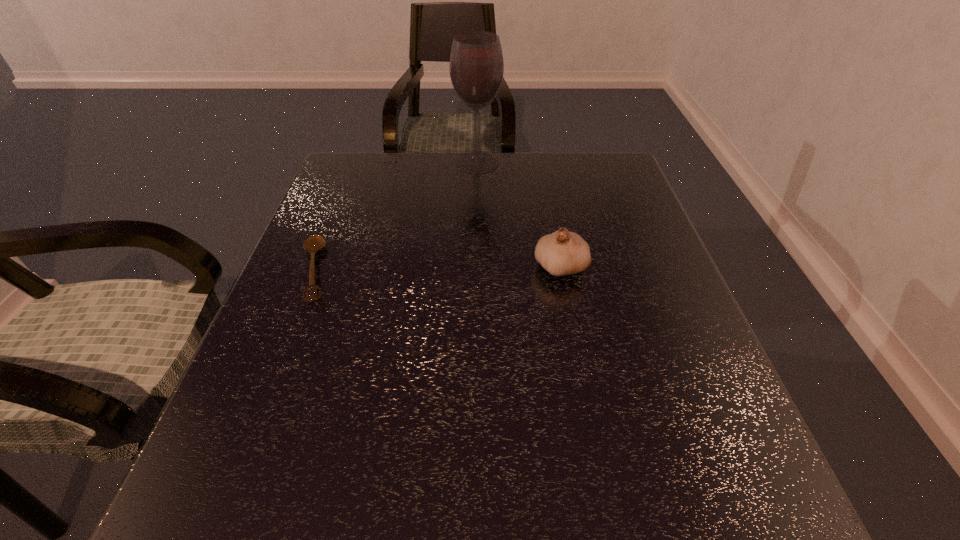
This screenshot has height=540, width=960. Find the location of `object that is at the left edge`. object that is at the left edge is located at coordinates (314, 243).

Where is `free space at the far edge of the desktop`? The image size is (960, 540). free space at the far edge of the desktop is located at coordinates (546, 160).

The image size is (960, 540). In the image, there is a desktop. Find the location of `vacant area at the near edge`. vacant area at the near edge is located at coordinates (372, 503).

In the image, there is a desktop. Where is `vacant space at the left edge`? vacant space at the left edge is located at coordinates (352, 262).

The image size is (960, 540). In the image, there is a desktop. What are the coordinates of `free space at the right edge` in the screenshot? It's located at 695,421.

This screenshot has height=540, width=960. What are the coordinates of `free region at the far left corner of the desktop` in the screenshot? It's located at (366, 167).

Image resolution: width=960 pixels, height=540 pixels. What are the coordinates of `free space at the near left corner of the desktop` in the screenshot? It's located at (209, 525).

You are a GUI agent. You are given a task and a screenshot of the screen. Output one action in this format:
    pyautogui.click(x=<x>, y=<y>)
    Task: Click on the vacant region at the far right corner of the desktop
    The height and width of the screenshot is (540, 960).
    Given the screenshot: What is the action you would take?
    pyautogui.click(x=571, y=173)

Locate an element on the screen. vacant space at the near right corner is located at coordinates (665, 491).

In order to click on free space between the shortest object and the tallest object in this screenshot , I will do `click(396, 217)`.